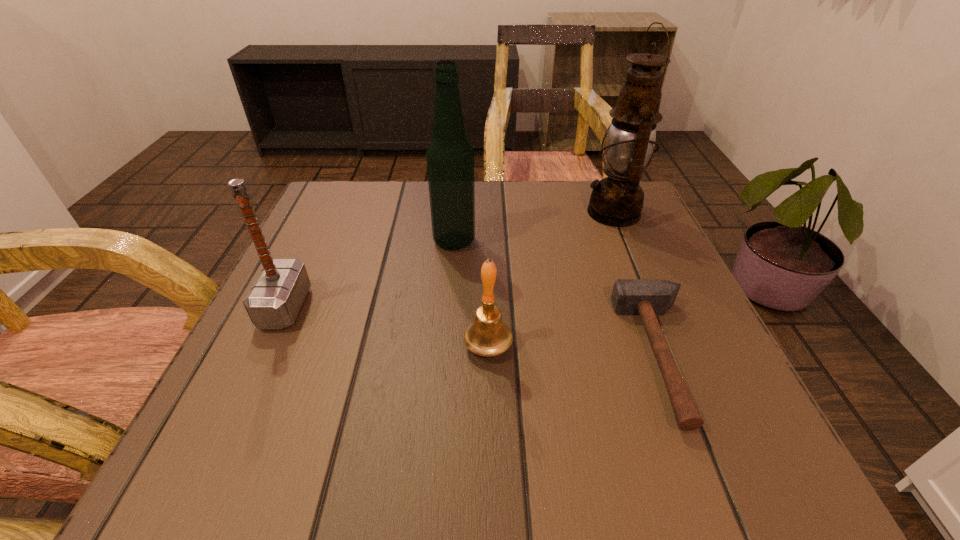
At what (x,y) coordinates should I click in order to perform the action: click on vacant space that's between the alcohol and the left hammer. Please return your answer as a coordinate pair (x, y). The width and height of the screenshot is (960, 540). Looking at the image, I should click on (370, 274).

Find the location of a particular element. This screenshot has height=540, width=960. vacant region between the shorter hammer and the fourth tallest object is located at coordinates (575, 351).

You are a GUI agent. You are given a task and a screenshot of the screen. Output one action in this format:
    pyautogui.click(x=<x>, y=<y>)
    Task: Click on the vacant space that's between the alcohol and the oil lamp
    
    Given the screenshot: What is the action you would take?
    pyautogui.click(x=534, y=227)

This screenshot has width=960, height=540. I want to click on blank region between the alcohol and the oil lamp, so click(534, 227).

Locate which object ranks fourth in proximity to the alcohol. Please provide its 2D coordinates. Your answer should be formatted as a tuple, i.e. [(x, y)], where the tuple contains the x and y coordinates of a point satisfying the conditions above.

[(646, 297)]

At what (x,y) coordinates should I click in order to perform the action: click on object that can be found as the second closest to the shortest object. Please return your answer as a coordinate pair (x, y). Image resolution: width=960 pixels, height=540 pixels. Looking at the image, I should click on (617, 200).

You are a GUI agent. You are given a task and a screenshot of the screen. Output one action in this format:
    pyautogui.click(x=<x>, y=<y>)
    Task: Click on the vacant area that satisfies the following two spatial constraints: 1. on the front side of the oil lamp; 2. on the striking surface of the third tallest object
    The image size is (960, 540).
    Given the screenshot: What is the action you would take?
    pyautogui.click(x=652, y=308)

Locate an element on the screen. This screenshot has width=960, height=540. free space that satisfies the following two spatial constraints: 1. on the front side of the bell; 2. on the left side of the alcohol is located at coordinates (446, 346).

Locate an element on the screen. The height and width of the screenshot is (540, 960). free spot that satisfies the following two spatial constraints: 1. on the front side of the alcohol; 2. on the striking surface of the taller hammer is located at coordinates (449, 308).